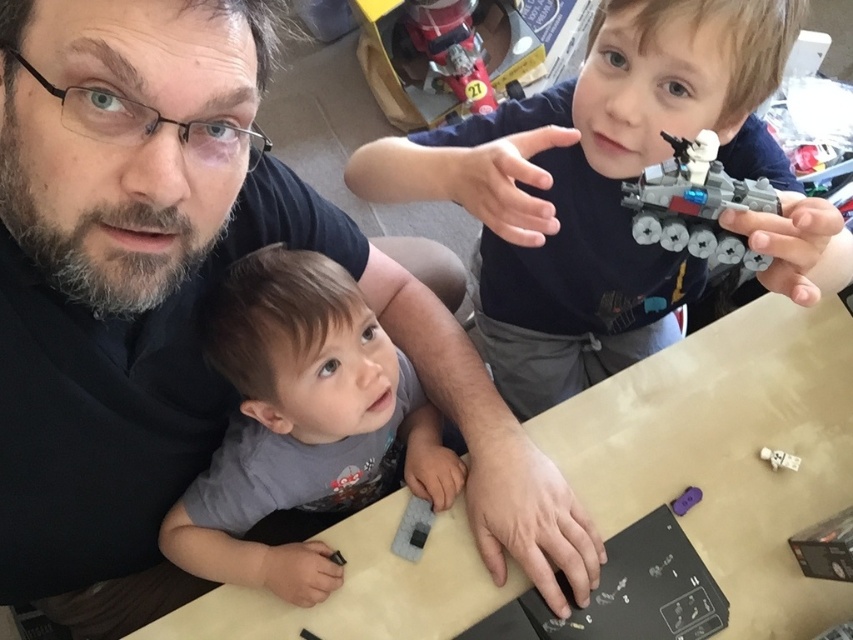
Between point (258, 396) and point (410, 10), which one is positioned behind?

The point (410, 10) is more distant.

Is gray matte shirt at lower left wider than metallic red firetruck at upper center?

Yes, gray matte shirt at lower left is wider than metallic red firetruck at upper center.

Does point (335, 362) lie behind point (476, 42)?

No, (335, 362) is in front of (476, 42).

Image resolution: width=853 pixels, height=640 pixels. I want to click on gray matte shirt at lower left, so click(300, 422).

Where is `matte black shirt at upper left`? matte black shirt at upper left is located at coordinates point(183,307).

Is point (451, 150) positioned behind point (683, 500)?

No.

Does shiny plastic spaceship at upper right have a smaller size compared to purple plastic toy at lower right?

No.

Which is behind, point (689, 80) or point (688, 497)?

The point (688, 497) is more distant.

Where is `shiny plastic spaceship at upper right`? This screenshot has height=640, width=853. shiny plastic spaceship at upper right is located at coordinates (611, 189).